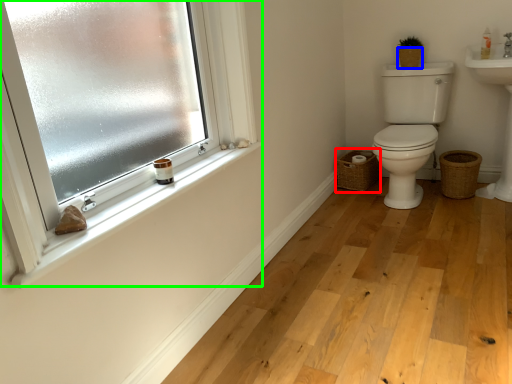
Question: Estimate the real-world distances between objects in this image. Which object is closer to basket (highlighted by a red box), basket (highlighted by a blue box) or window (highlighted by a green box)?

Choices:
 (A) basket
 (B) window

Answer: (A)